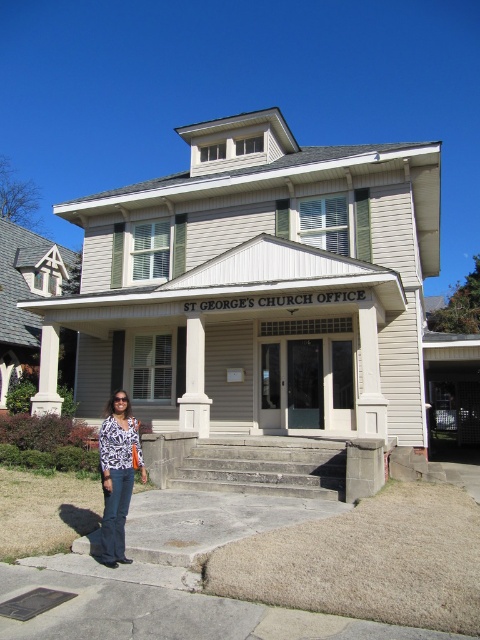
You are a delivery person trying to reach the entrance of St George Church Office. You see the gray concrete stairs at center and the printed fabric blouse at lower left. Which object is closer to the entrance?

The gray concrete stairs at center is closer to the entrance because it is shorter than the printed fabric blouse at lower left, indicating it is nearer.

You are a delivery person holding a package and need to reach the entrance of St George Church Office. You see the gray concrete stairs at center and the printed fabric blouse at lower left. Which object is closer to the entrance?

The gray concrete stairs at center are closer to the entrance than the printed fabric blouse at lower left because the distance between them is 13.26 feet, so the stairs are nearer to the entrance.